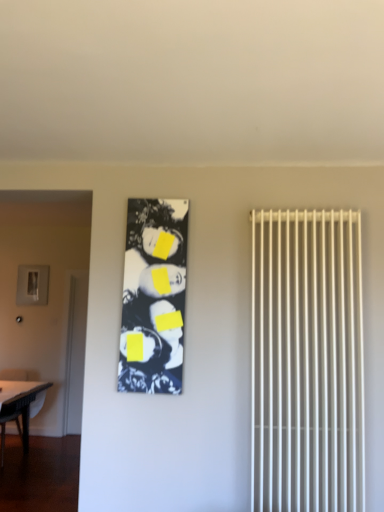
Question: From the image's perspective, does black glossy photo frame at center appear lower than matte gray screen door at left?

Choices:
 (A) yes
 (B) no

Answer: (B)

Question: Considering the relative sizes of black glossy photo frame at center and matte gray screen door at left in the image provided, is black glossy photo frame at center thinner than matte gray screen door at left?

Choices:
 (A) no
 (B) yes

Answer: (A)

Question: From a real-world perspective, is black glossy photo frame at center over matte gray screen door at left?

Choices:
 (A) yes
 (B) no

Answer: (A)

Question: Considering the relative positions of black glossy photo frame at center and matte gray screen door at left in the image provided, is black glossy photo frame at center to the left of matte gray screen door at left from the viewer's perspective?

Choices:
 (A) no
 (B) yes

Answer: (A)

Question: Is black glossy photo frame at center in contact with matte gray screen door at left?

Choices:
 (A) yes
 (B) no

Answer: (B)

Question: Is black glossy photo frame at center facing away from matte gray screen door at left?

Choices:
 (A) no
 (B) yes

Answer: (A)

Question: Does black glossy photo frame at center have a smaller size compared to white plastic radiator at right?

Choices:
 (A) no
 (B) yes

Answer: (B)

Question: Considering the relative sizes of black glossy photo frame at center and white plastic radiator at right in the image provided, is black glossy photo frame at center wider than white plastic radiator at right?

Choices:
 (A) yes
 (B) no

Answer: (B)

Question: From a real-world perspective, is black glossy photo frame at center positioned over white plastic radiator at right based on gravity?

Choices:
 (A) no
 (B) yes

Answer: (B)

Question: Is black glossy photo frame at center far away from white plastic radiator at right?

Choices:
 (A) no
 (B) yes

Answer: (A)

Question: Is black glossy photo frame at center at the right side of white plastic radiator at right?

Choices:
 (A) yes
 (B) no

Answer: (B)

Question: Is black glossy photo frame at center positioned behind white plastic radiator at right?

Choices:
 (A) yes
 (B) no

Answer: (A)

Question: Is the position of black glossy photo frame at center more distant than that of white glossy table at lower left?

Choices:
 (A) no
 (B) yes

Answer: (A)